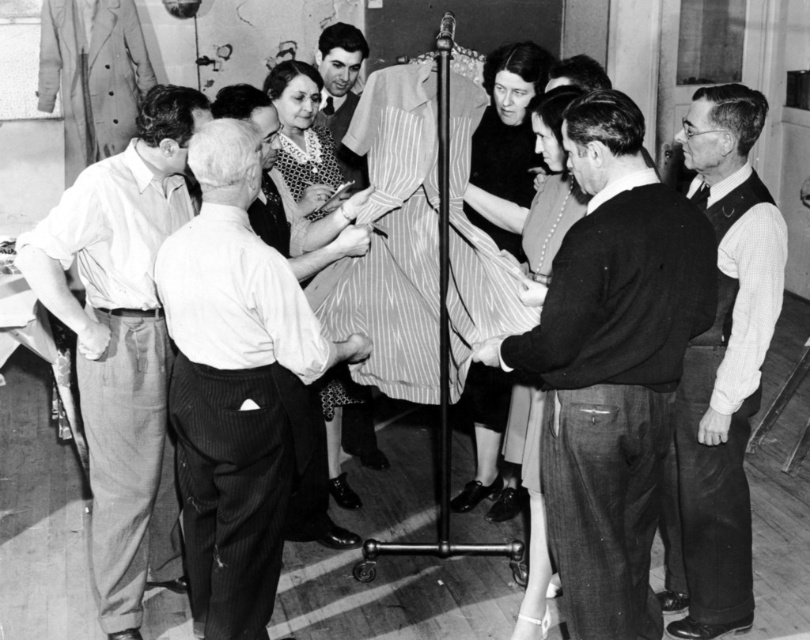
You are a tailor standing behind the mannequin and need to adjust the white pinstripe suit at center and the patterned fabric dress at center. Which garment should you reach for first to make adjustments without moving around the mannequin?

The white pinstripe suit at center is closer to the viewer than the patterned fabric dress at center, so you should reach for the white pinstripe suit at center first as it is more accessible.

You are a tailor in a workshop and need to adjust the sleeves of the dark gray sweater at center and the white pinstripe suit at center. Which garment should you adjust first if you want to start with the one that is higher up?

The dark gray sweater at center is above the white pinstripe suit at center, so you should adjust the dark gray sweater at center first since it is positioned higher.

You are a tailor in the workshop. You need to adjust the sleeve length of the striped garment on the mannequin. The point you should focus on is located at coordinates point (612,364). Which garment part is this point on?

The point (612,364) is on the dark gray sweater at center, so the tailor should focus on the dark gray sweater at center to adjust the sleeve length.